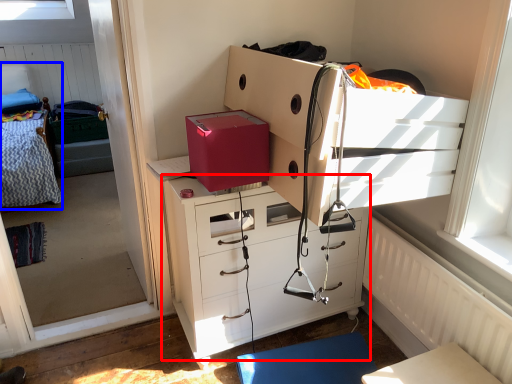
Question: Which object appears farthest to the camera in this image, chest of drawers (highlighted by a red box) or hospital bed (highlighted by a blue box)?

Choices:
 (A) chest of drawers
 (B) hospital bed

Answer: (B)